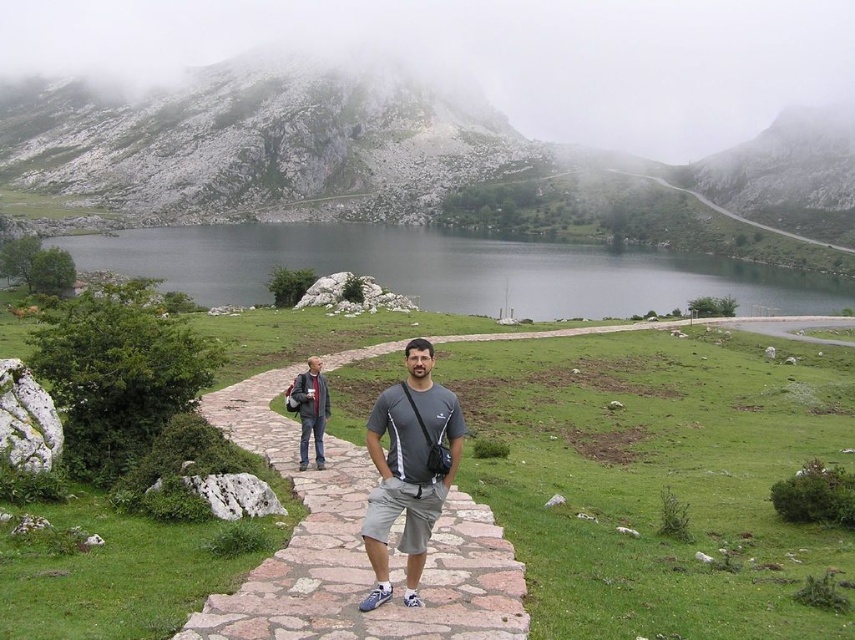
How far apart are smooth gray water at center and gray fabric shirt at center?

smooth gray water at center is 342.05 feet away from gray fabric shirt at center.

Is smooth gray water at center to the left of gray fabric shirt at center from the viewer's perspective?

Correct, you'll find smooth gray water at center to the left of gray fabric shirt at center.

Which is behind, point (632, 285) or point (369, 417)?

Point (632, 285)

Where is `smooth gray water at center`? smooth gray water at center is located at coordinates (450, 269).

Does smooth gray water at center have a lesser width compared to dark gray fabric jacket at center-left?

In fact, smooth gray water at center might be wider than dark gray fabric jacket at center-left.

Can you confirm if smooth gray water at center is positioned above dark gray fabric jacket at center-left?

Correct, smooth gray water at center is located above dark gray fabric jacket at center-left.

Does point (715, 289) come closer to viewer compared to point (310, 424)?

No, it is behind (310, 424).

Locate an element on the screen. The image size is (855, 640). smooth gray water at center is located at coordinates (450, 269).

Which is more to the right, rocky gray mountain at upper left or gray fabric shirt at center?

gray fabric shirt at center is more to the right.

Does rocky gray mountain at upper left lie in front of gray fabric shirt at center?

That is False.

Measure the distance between rocky gray mountain at upper left and camera.

rocky gray mountain at upper left and camera are 593.30 feet apart from each other.

You are a GUI agent. You are given a task and a screenshot of the screen. Output one action in this format:
    pyautogui.click(x=<x>, y=<y>)
    Task: Click on the rocky gray mountain at upper left
    
    Given the screenshot: What is the action you would take?
    pyautogui.click(x=364, y=148)